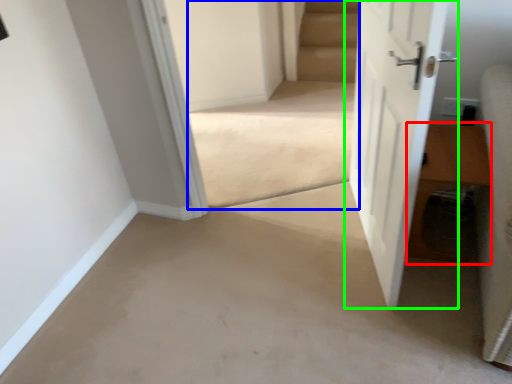
Question: Which object is positioned farthest from hardwood (highlighted by a red box)? Select from stairwell (highlighted by a blue box) and door (highlighted by a green box).

Choices:
 (A) stairwell
 (B) door

Answer: (A)